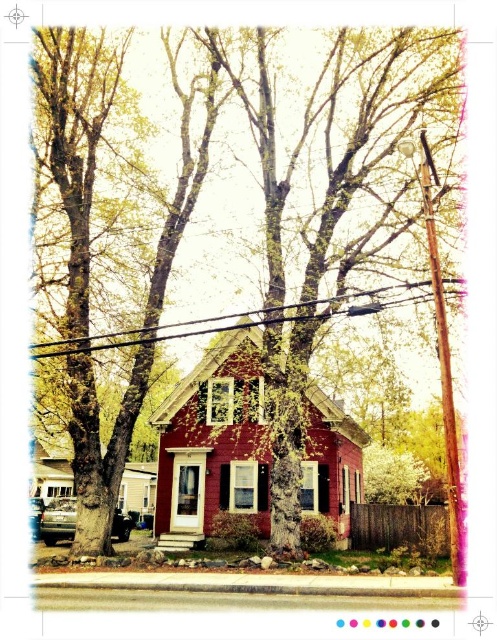
Is smooth bark tree at center to the left of black wire at upper center from the viewer's perspective?

In fact, smooth bark tree at center is to the right of black wire at upper center.

Describe the element at coordinates (313, 246) in the screenshot. I see `smooth bark tree at center` at that location.

Does point (163, 426) come behind point (45, 356)?

Yes, it is behind point (45, 356).

Locate an element on the screen. This screenshot has height=640, width=497. smooth bark tree at center is located at coordinates (313, 246).